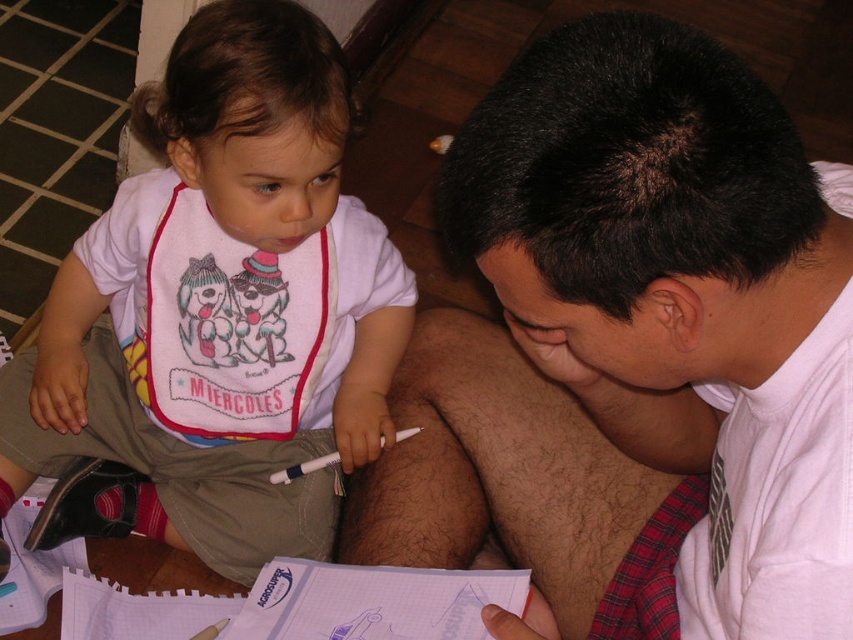
Question: Which object appears farthest from the camera in this image?

Choices:
 (A) white cotton bib at upper left
 (B) white shirt at upper right

Answer: (A)

Question: Is white shirt at upper right thinner than white cotton bib at upper left?

Choices:
 (A) no
 (B) yes

Answer: (B)

Question: Does white shirt at upper right have a larger size compared to white cotton bib at upper left?

Choices:
 (A) yes
 (B) no

Answer: (A)

Question: Which point appears farthest from the camera in this image?

Choices:
 (A) (231, 38)
 (B) (485, 278)

Answer: (B)

Question: In this image, where is white shirt at upper right located relative to white cotton bib at upper left?

Choices:
 (A) below
 (B) above

Answer: (A)